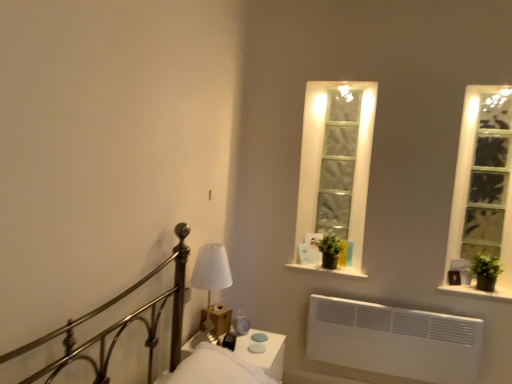
Locate an element on the screen. vacant region below green matte plant at right, which ranks as the 2th plant in left-to-right order (from a real-world perspective) is located at coordinates (484, 295).